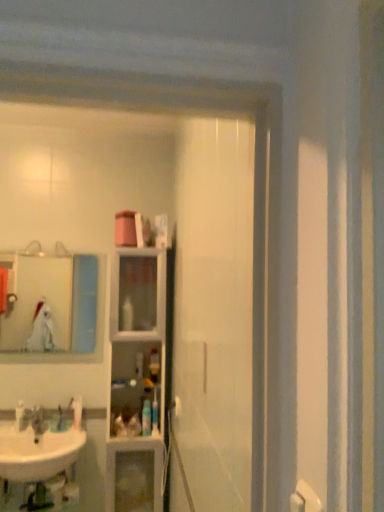
At what (x,y) coordinates should I click in order to perform the action: click on empty space that is ontop of white glossy sink at lower left (from a real-world perspective). Please return your answer as a coordinate pair (x, y). Looking at the image, I should click on (33, 438).